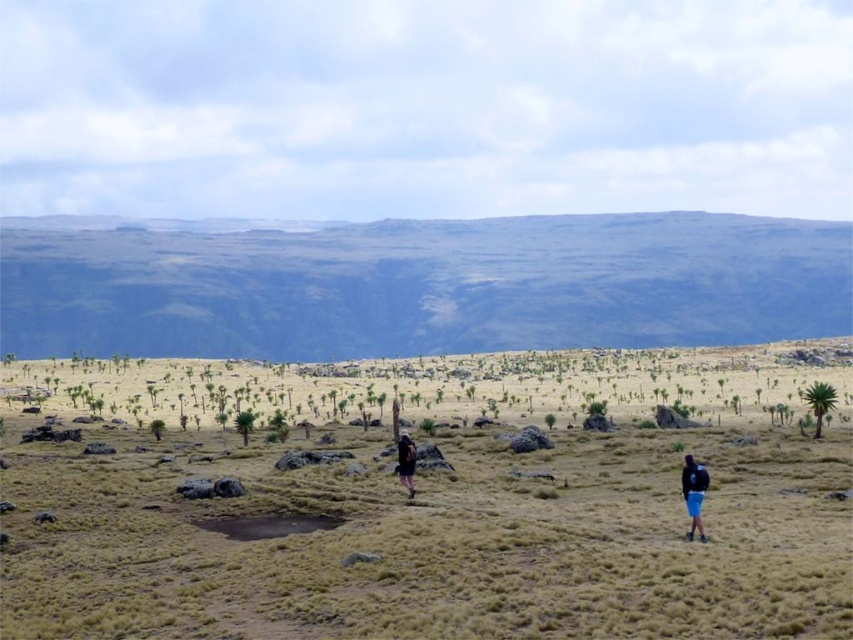
Question: Does green grassy hill at upper center come behind black fabric backpack at center?

Choices:
 (A) no
 (B) yes

Answer: (B)

Question: Which point is farther from the camera taking this photo?

Choices:
 (A) (154, 240)
 (B) (408, 486)
 (C) (669, 396)
 (D) (688, 536)

Answer: (A)

Question: Is green grassy hill at upper center closer to camera compared to blue fabric backpack at lower right?

Choices:
 (A) no
 (B) yes

Answer: (A)

Question: Can you confirm if green grassy hill at upper center is thinner than black fabric backpack at center?

Choices:
 (A) yes
 (B) no

Answer: (B)

Question: Among these objects, which one is nearest to the camera?

Choices:
 (A) green grassy hill at upper center
 (B) black fabric backpack at center

Answer: (B)

Question: Among these points, which one is nearest to the camera?

Choices:
 (A) (711, 465)
 (B) (697, 528)

Answer: (B)